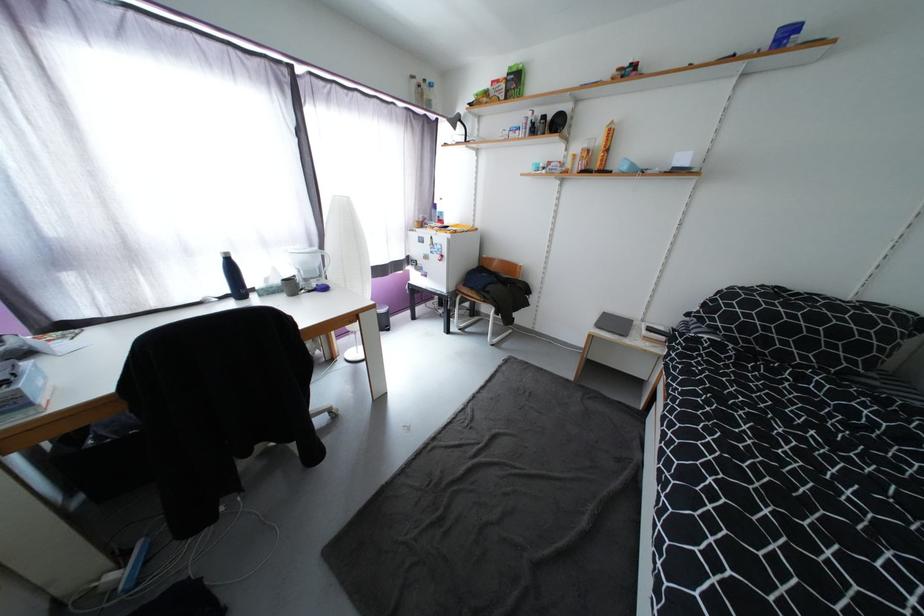
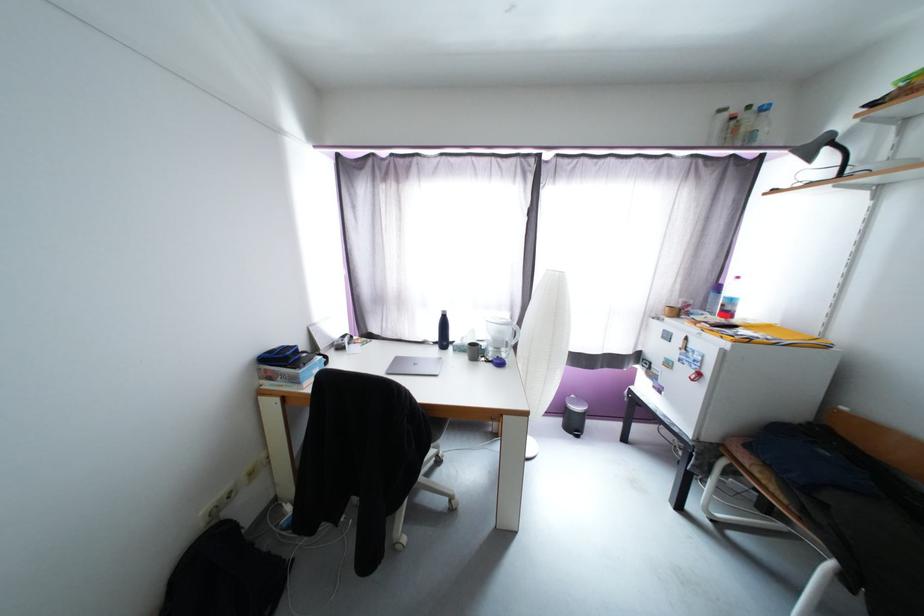
Question: The camera is either moving clockwise (left) or counter-clockwise (right) around the object. The first image is from the beginning of the video and the second image is from the end. Is the camera moving left or right when shooting the video?

Choices:
 (A) Left
 (B) Right

Answer: (B)